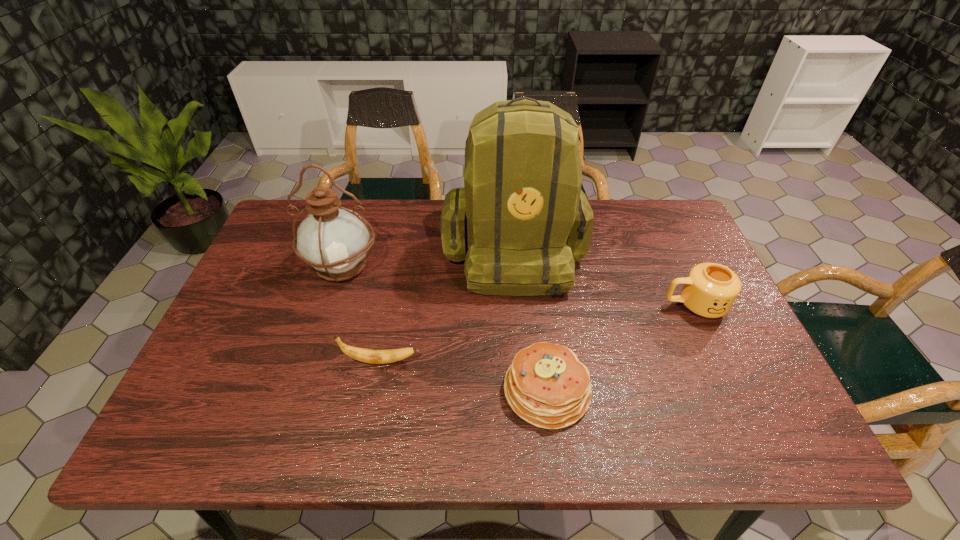
Where is `free spot at the near edge of the desktop`? This screenshot has height=540, width=960. free spot at the near edge of the desktop is located at coordinates (451, 419).

Locate an element on the screen. vacant space at the left edge of the desktop is located at coordinates (248, 350).

In the image, there is a desktop. At what (x,y) coordinates should I click in order to perform the action: click on free space at the right edge. Please return your answer as a coordinate pair (x, y). The height and width of the screenshot is (540, 960). Looking at the image, I should click on (667, 260).

Identify the location of free space between the oil lamp and the backpack. (428, 258).

I want to click on vacant area that lies between the third shortest object and the banana, so click(538, 333).

Locate an element on the screen. unoccupied position between the banana and the third shortest object is located at coordinates (538, 333).

Find the location of a particular element. vacant area between the rightmost object and the tallest object is located at coordinates (604, 278).

I want to click on vacant space in between the tallest object and the banana, so click(446, 306).

Find the location of `unoccupied position between the backpack and the pancake`. unoccupied position between the backpack and the pancake is located at coordinates (530, 320).

The height and width of the screenshot is (540, 960). I want to click on free space between the banana and the pancake, so click(464, 376).